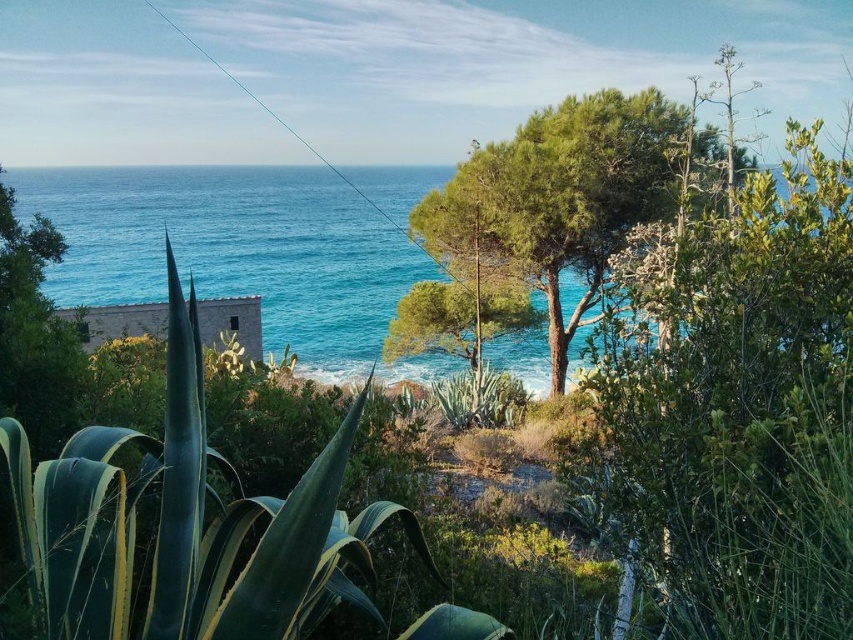
Question: Can you confirm if green leafy tree at center is smaller than green leafy tree at left?

Choices:
 (A) no
 (B) yes

Answer: (A)

Question: Which point is farther from the camera taking this photo?

Choices:
 (A) (630, 140)
 (B) (277, 337)

Answer: (B)

Question: Among these objects, which one is farthest from the camera?

Choices:
 (A) green leafy tree at left
 (B) green leafy tree at center
 (C) blue water at left

Answer: (B)

Question: Which point is closer to the camera?

Choices:
 (A) (463, 164)
 (B) (386, 307)

Answer: (A)

Question: Can you confirm if blue water at left is positioned above green leafy tree at left?

Choices:
 (A) yes
 (B) no

Answer: (A)

Question: In this image, where is blue water at left located relative to green leafy tree at center?

Choices:
 (A) above
 (B) below

Answer: (A)